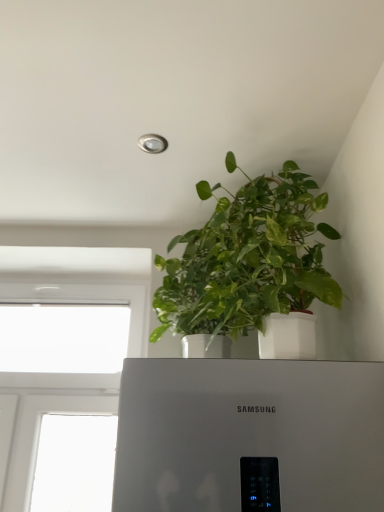
Locate an element on the screen. The image size is (384, 512). green matte plant at upper center is located at coordinates (248, 260).

What is the approximate width of green matte plant at upper center?

green matte plant at upper center is 23.64 inches wide.

Describe the element at coordinates (248, 260) in the screenshot. The width and height of the screenshot is (384, 512). I see `green matte plant at upper center` at that location.

Image resolution: width=384 pixels, height=512 pixels. What are the coordinates of `green matte plant at upper center` in the screenshot? It's located at (248, 260).